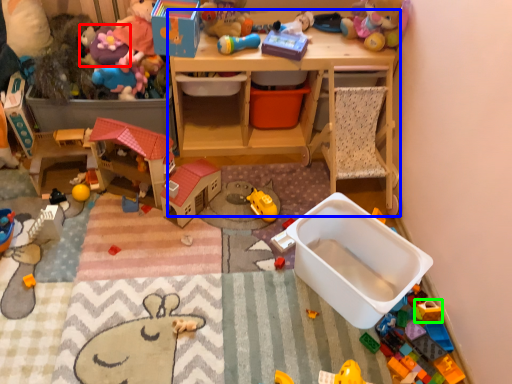
Question: Which object is the farthest from toy (highlighted by a red box)? Choose among these: desk (highlighted by a blue box) or toy (highlighted by a green box).

Choices:
 (A) desk
 (B) toy

Answer: (B)